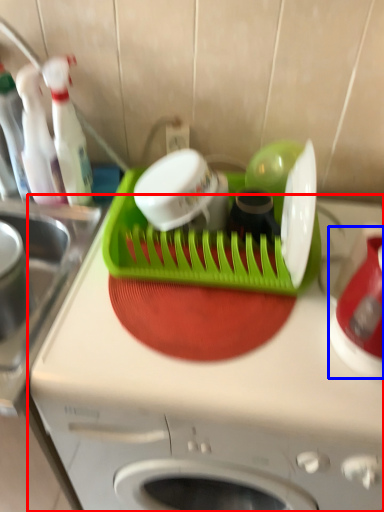
Question: Which object is closer to the camera taking this photo, home appliance (highlighted by a red box) or appliance (highlighted by a blue box)?

Choices:
 (A) home appliance
 (B) appliance

Answer: (B)